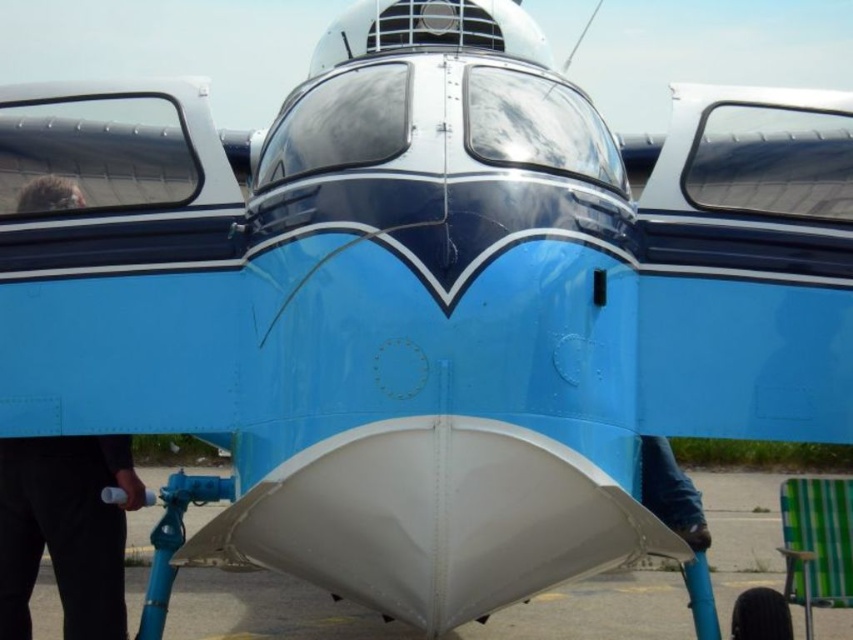
Question: Which object appears closest to the camera in this image?

Choices:
 (A) white matte tarmac at center
 (B) black matte hair at left
 (C) green checkered chair at lower right

Answer: (B)

Question: Which point is farther from the camera taking this photo?

Choices:
 (A) (62, 536)
 (B) (654, 637)
 (C) (845, 573)

Answer: (B)

Question: Does black matte hair at left have a lesser width compared to green checkered chair at lower right?

Choices:
 (A) no
 (B) yes

Answer: (A)

Question: Can you confirm if black matte hair at left is thinner than green checkered chair at lower right?

Choices:
 (A) no
 (B) yes

Answer: (A)

Question: Which of the following is the farthest from the observer?

Choices:
 (A) white matte tarmac at center
 (B) black matte hair at left

Answer: (A)

Question: Is black matte hair at left wider than green checkered chair at lower right?

Choices:
 (A) yes
 (B) no

Answer: (A)